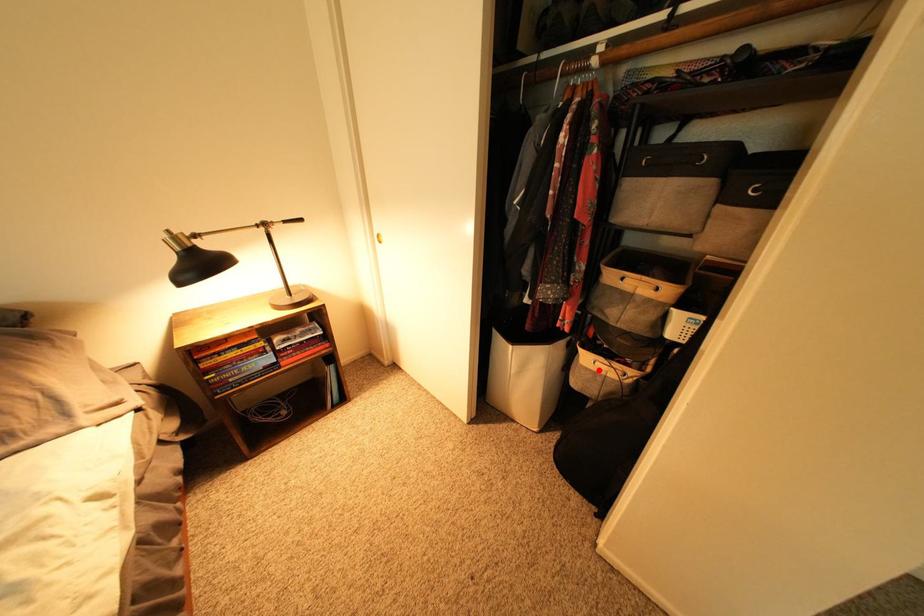
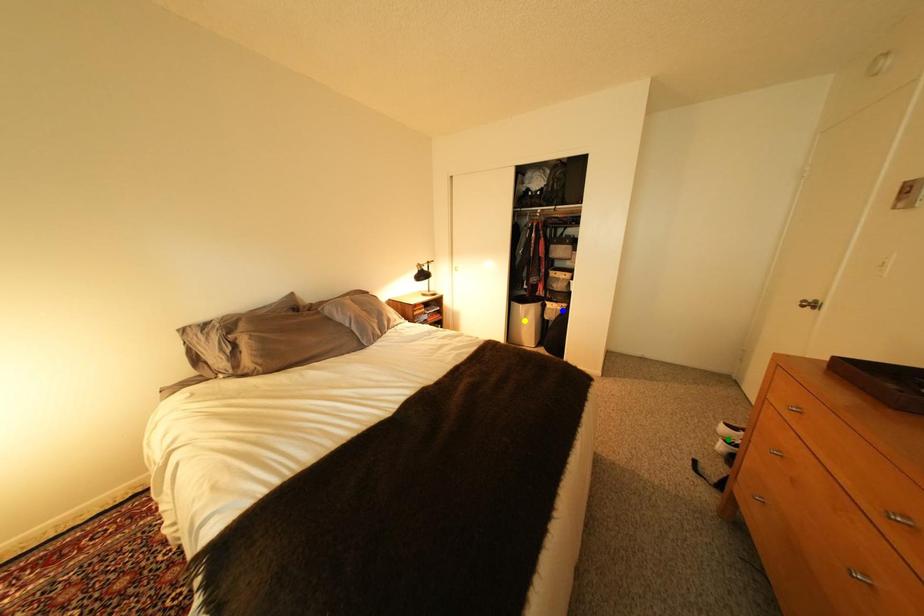
Question: I am providing you with two images of the same scene from different viewpoints. A red point is marked on the first image. You are given multiple points on the second image. Which point in image 2 is actually the same real-world point as the red point in image 1?

Choices:
 (A) green point
 (B) yellow point
 (C) blue point

Answer: (C)